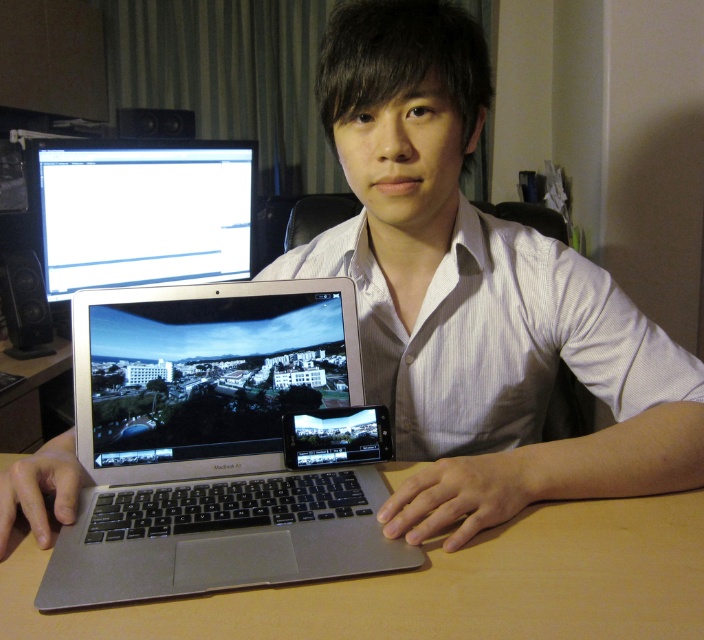
Is brown wooden table at center below white glossy monitor at upper left?

Correct, brown wooden table at center is located below white glossy monitor at upper left.

Does point (591, 534) come farther from viewer compared to point (146, 273)?

No, (591, 534) is in front of (146, 273).

Which is behind, point (529, 563) or point (151, 241)?

Point (151, 241)

Locate an element on the screen. The image size is (704, 640). brown wooden table at center is located at coordinates (439, 586).

Is silver metallic laptop at center to the right of brown wooden table at center from the viewer's perspective?

No, silver metallic laptop at center is not to the right of brown wooden table at center.

Is silver metallic laptop at center positioned at the back of brown wooden table at center?

Yes, silver metallic laptop at center is further from the viewer.

Locate an element on the screen. This screenshot has height=640, width=704. silver metallic laptop at center is located at coordinates click(210, 444).

Who is more distant from viewer, (272,481) or (132,260)?

The point (132,260) is more distant.

Is the position of silver metallic laptop at center more distant than that of white glossy monitor at upper left?

No, it is in front of white glossy monitor at upper left.

Locate an element on the screen. silver metallic laptop at center is located at coordinates (210, 444).